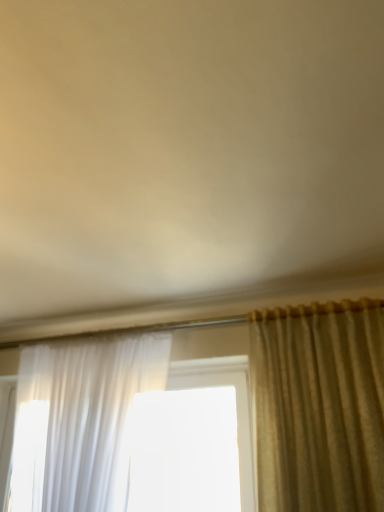
Question: Is silky beige curtain at right, placed as the 2th curtain when sorted from left to right, wider than sheer white curtain at left, acting as the 1th curtain starting from the left?

Choices:
 (A) no
 (B) yes

Answer: (A)

Question: Considering the relative sizes of silky beige curtain at right, placed as the 2th curtain when sorted from left to right, and sheer white curtain at left, acting as the 1th curtain starting from the left, in the image provided, is silky beige curtain at right, placed as the 2th curtain when sorted from left to right, smaller than sheer white curtain at left, acting as the 1th curtain starting from the left,?

Choices:
 (A) no
 (B) yes

Answer: (B)

Question: From the image's perspective, is silky beige curtain at right, arranged as the 1th curtain when viewed from the right, located beneath sheer white curtain at left, acting as the 1th curtain starting from the left?

Choices:
 (A) yes
 (B) no

Answer: (B)

Question: Can sheer white curtain at left, acting as the 1th curtain starting from the left, be found inside silky beige curtain at right, placed as the 2th curtain when sorted from left to right?

Choices:
 (A) yes
 (B) no

Answer: (B)

Question: Is silky beige curtain at right, arranged as the 1th curtain when viewed from the right, next to sheer white curtain at left, the second curtain from the right?

Choices:
 (A) yes
 (B) no

Answer: (B)

Question: Is silky beige curtain at right, placed as the 2th curtain when sorted from left to right, to the left of sheer white curtain at left, the second curtain from the right, from the viewer's perspective?

Choices:
 (A) no
 (B) yes

Answer: (A)

Question: Is sheer white curtain at left, acting as the 1th curtain starting from the left, at the left side of silky beige curtain at right, placed as the 2th curtain when sorted from left to right?

Choices:
 (A) no
 (B) yes

Answer: (B)

Question: Is sheer white curtain at left, acting as the 1th curtain starting from the left, facing towards silky beige curtain at right, arranged as the 1th curtain when viewed from the right?

Choices:
 (A) no
 (B) yes

Answer: (A)

Question: Does sheer white curtain at left, the second curtain from the right, have a smaller size compared to silky beige curtain at right, placed as the 2th curtain when sorted from left to right?

Choices:
 (A) no
 (B) yes

Answer: (A)

Question: Considering the relative sizes of sheer white curtain at left, the second curtain from the right, and silky beige curtain at right, arranged as the 1th curtain when viewed from the right, in the image provided, is sheer white curtain at left, the second curtain from the right, shorter than silky beige curtain at right, arranged as the 1th curtain when viewed from the right,?

Choices:
 (A) no
 (B) yes

Answer: (A)

Question: Does sheer white curtain at left, acting as the 1th curtain starting from the left, contain silky beige curtain at right, placed as the 2th curtain when sorted from left to right?

Choices:
 (A) no
 (B) yes

Answer: (A)

Question: Is there a large distance between sheer white curtain at left, acting as the 1th curtain starting from the left, and silky beige curtain at right, arranged as the 1th curtain when viewed from the right?

Choices:
 (A) yes
 (B) no

Answer: (B)

Question: Is silky beige curtain at right, placed as the 2th curtain when sorted from left to right, wider or thinner than sheer white curtain at left, the second curtain from the right?

Choices:
 (A) thin
 (B) wide

Answer: (A)